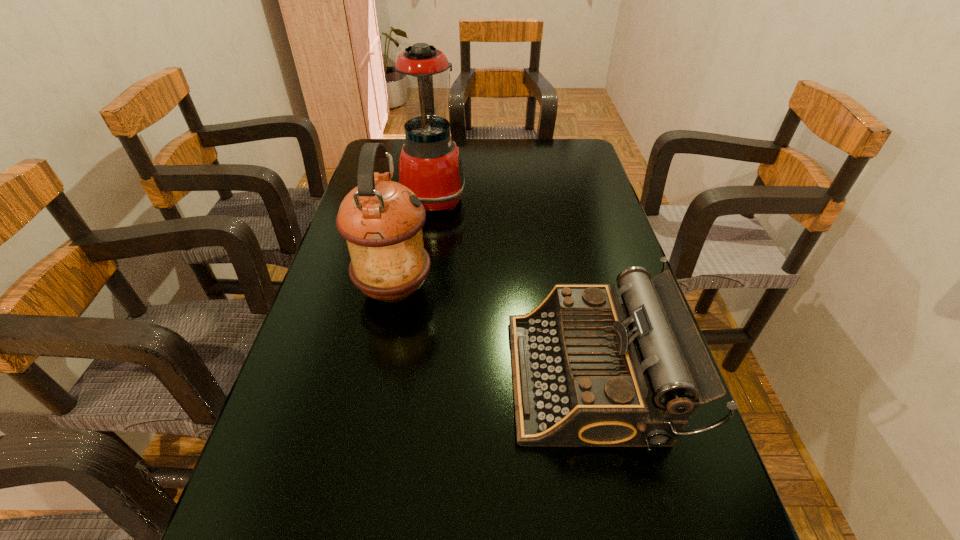
At what (x,y) coordinates should I click in order to perform the action: click on vacant area between the oil lamp and the shortest object. Please return your answer as a coordinate pair (x, y). Looking at the image, I should click on (492, 333).

This screenshot has width=960, height=540. In order to click on empty space between the shortest object and the second shortest object in this screenshot , I will do `click(492, 333)`.

Choose which object is the nearest neighbor to the second tallest object. Please provide its 2D coordinates. Your answer should be formatted as a tuple, i.e. [(x, y)], where the tuple contains the x and y coordinates of a point satisfying the conditions above.

[(592, 367)]

This screenshot has width=960, height=540. In order to click on object that is the second closest to the tallest object in this screenshot , I will do `click(592, 367)`.

You are a GUI agent. You are given a task and a screenshot of the screen. Output one action in this format:
    pyautogui.click(x=<x>, y=<y>)
    Task: Click on the free spot that satisfies the following two spatial constraints: 1. on the controls of the food processor; 2. on the front side of the oil lamp
    Image resolution: width=960 pixels, height=540 pixels.
    Given the screenshot: What is the action you would take?
    pyautogui.click(x=420, y=289)

The height and width of the screenshot is (540, 960). What are the coordinates of `free spot that satisfies the following two spatial constraints: 1. on the controls of the food processor; 2. on the front side of the second shortest object` in the screenshot? It's located at (420, 289).